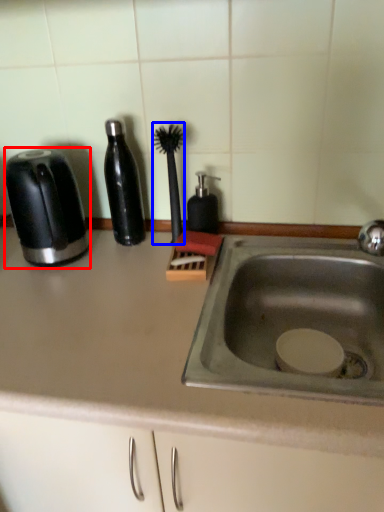
Question: Which point is closer to the camera, toaster (highlighted by a red box) or brush (highlighted by a blue box)?

Choices:
 (A) toaster
 (B) brush

Answer: (A)